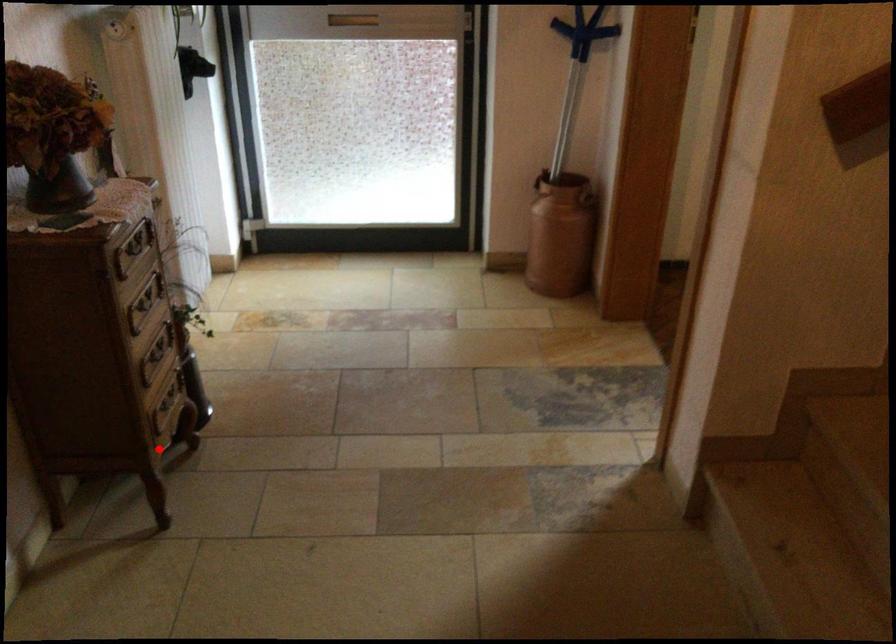
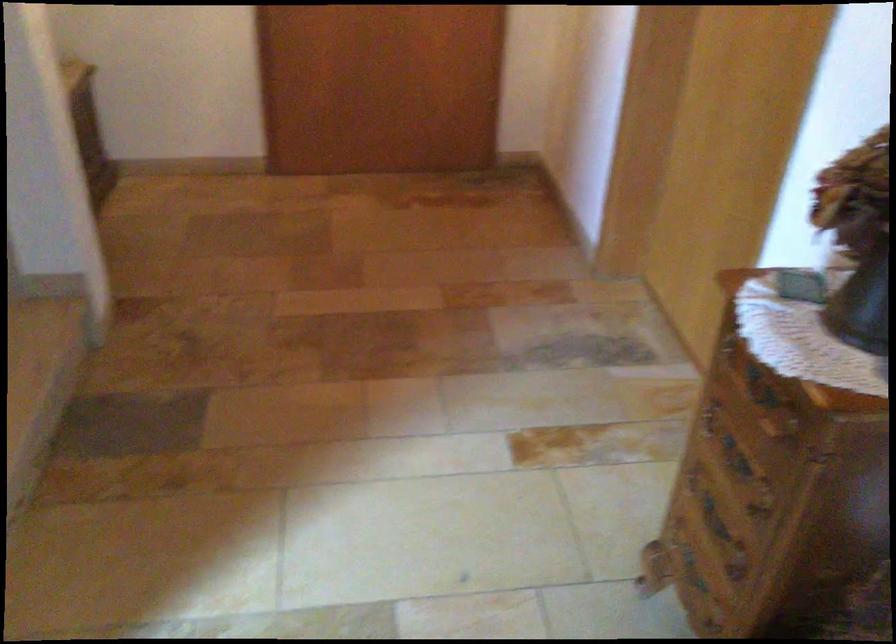
Question: I am providing you with two images of the same scene from different viewpoints. In image1, a red point is highlighted. Considering the same 3D point in image2, which of the following is correct?

Choices:
 (A) It is closer
 (B) It is farther

Answer: (A)